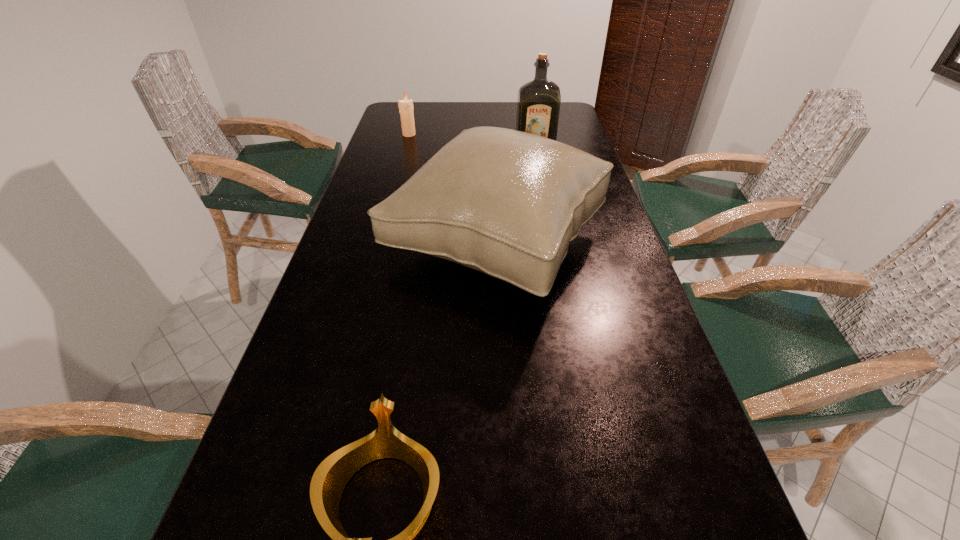
Identify the location of liquor located at the right edge. (538, 106).

You are a GUI agent. You are given a task and a screenshot of the screen. Output one action in this format:
    pyautogui.click(x=<x>, y=<y>)
    Task: Click on the cushion that is at the right edge
    Image resolution: width=960 pixels, height=540 pixels.
    Given the screenshot: What is the action you would take?
    pyautogui.click(x=507, y=203)

Find the location of a particular element. The image size is (960, 540). free location at the far edge of the desktop is located at coordinates (438, 111).

Find the location of a particular element. The height and width of the screenshot is (540, 960). free space at the left edge of the desktop is located at coordinates (390, 134).

The width and height of the screenshot is (960, 540). In the image, there is a desktop. Identify the location of blank space at the right edge. [633, 340].

Locate an element on the screen. The height and width of the screenshot is (540, 960). free space at the far right corner of the desktop is located at coordinates (572, 115).

In order to click on object that can be found as the third closest to the candle in this screenshot , I will do 330,478.

Locate which object is the closest to the cushion. Please provide its 2D coordinates. Your answer should be formatted as a tuple, i.e. [(x, y)], where the tuple contains the x and y coordinates of a point satisfying the conditions above.

[(538, 106)]